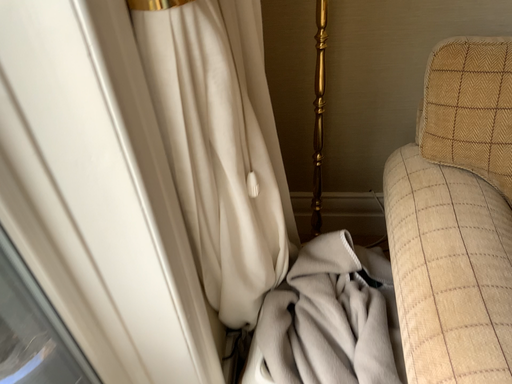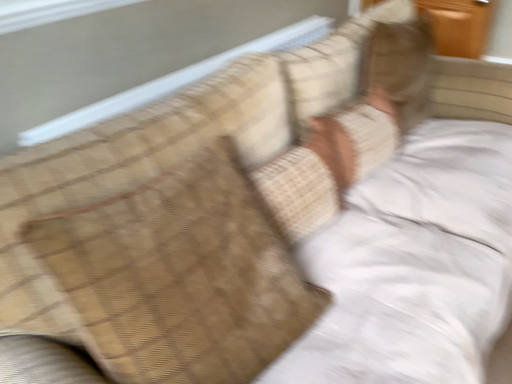
Question: Which way did the camera rotate in the video?

Choices:
 (A) rotated left
 (B) rotated right

Answer: (B)